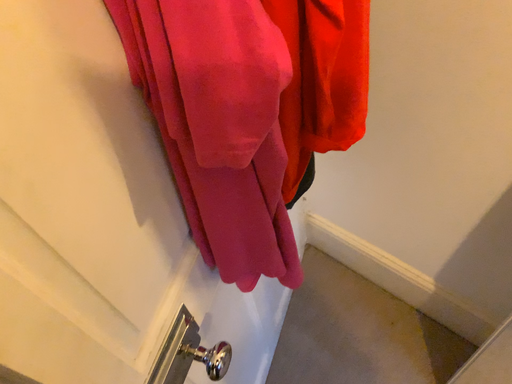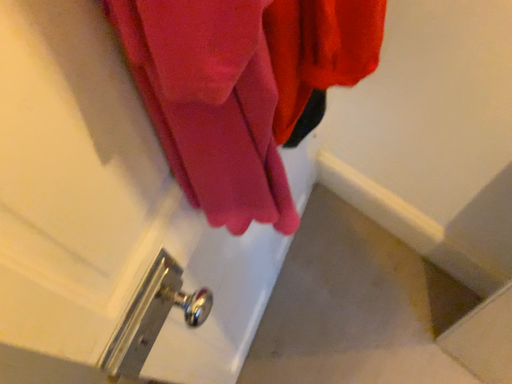
Question: How did the camera likely rotate when shooting the video?

Choices:
 (A) rotated downward
 (B) rotated upward

Answer: (A)